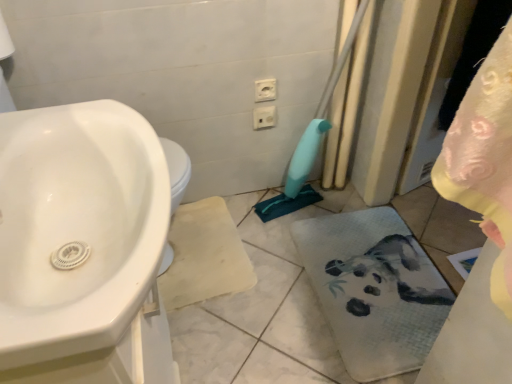
Where is `vacant space to the left of white fabric bath towel at lower right`? This screenshot has width=512, height=384. vacant space to the left of white fabric bath towel at lower right is located at coordinates (250, 284).